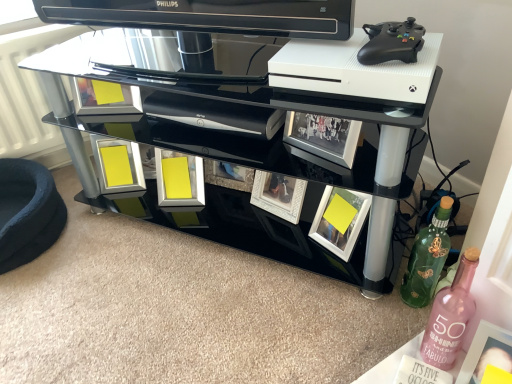
Locate an element on the screen. Image resolution: width=512 pixels, height=384 pixels. empty space that is in between matte yellow picture frame at lower center, positioned as the 2th picture frame in back-to-front order, and velvet cushion at lower left is located at coordinates (109, 225).